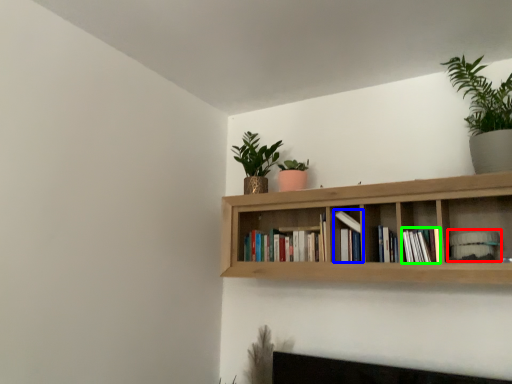
Question: Considering the real-world distances, which object is farthest from book (highlighted by a red box)? book (highlighted by a blue box) or book (highlighted by a green box)?

Choices:
 (A) book
 (B) book

Answer: (A)